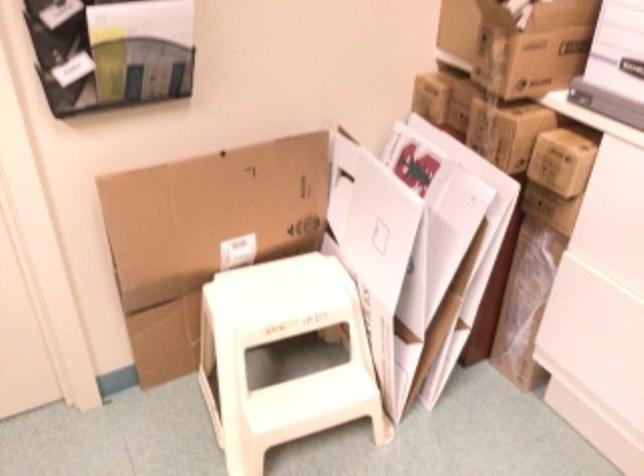
Where would you stepping on the step stool top surface? Please return your answer as a coordinate pair (x, y).

(283, 295)